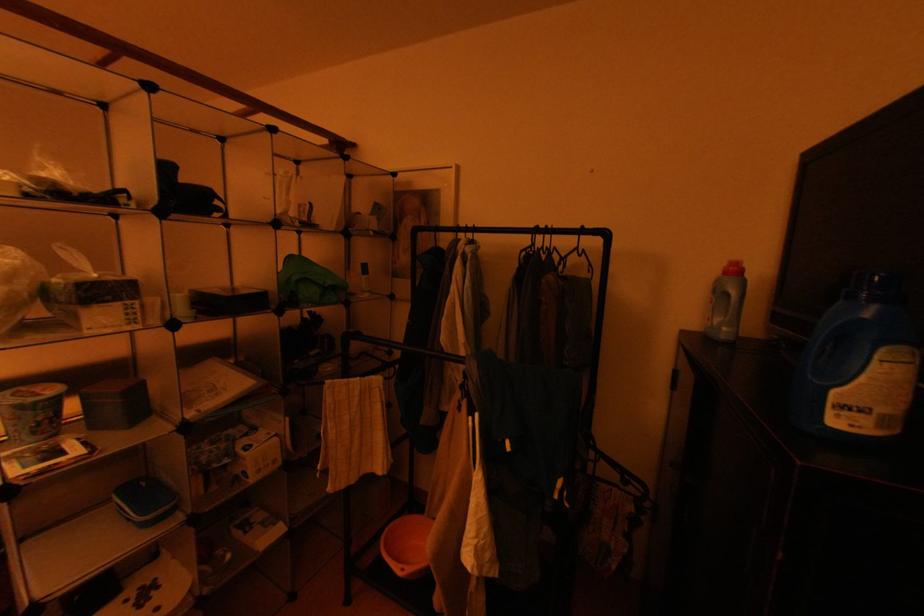
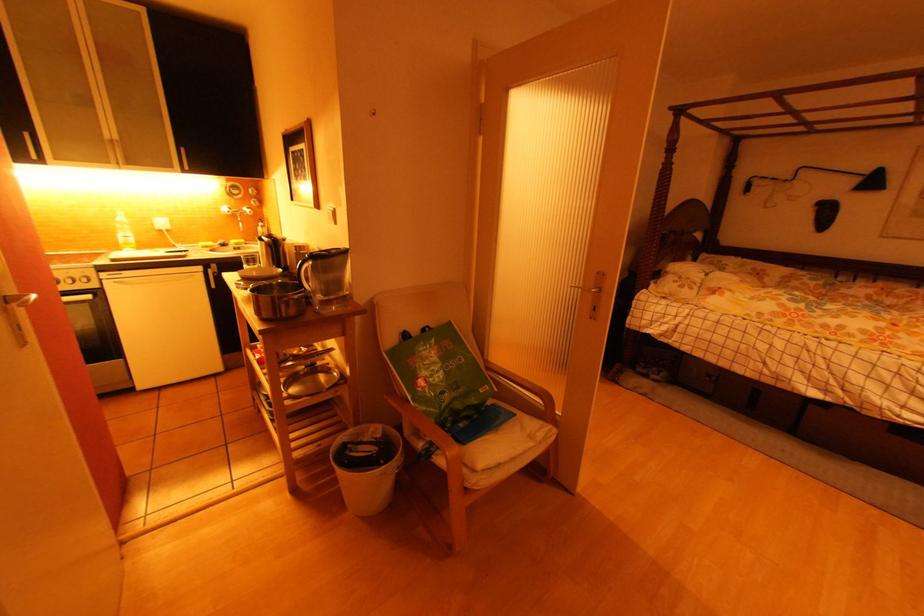
What movement of the cameraman would produce the second image?

The movement direction of the cameraman is left, backward.